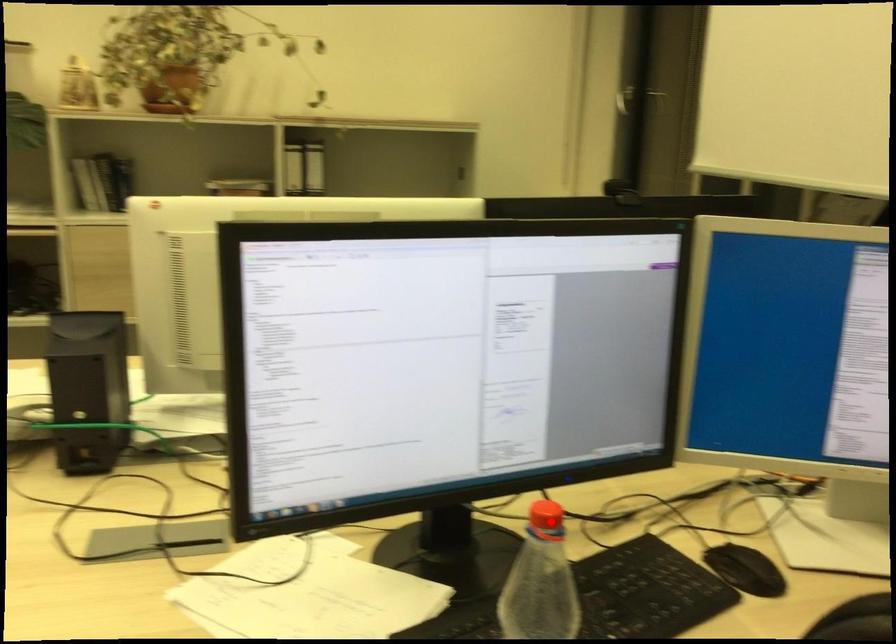
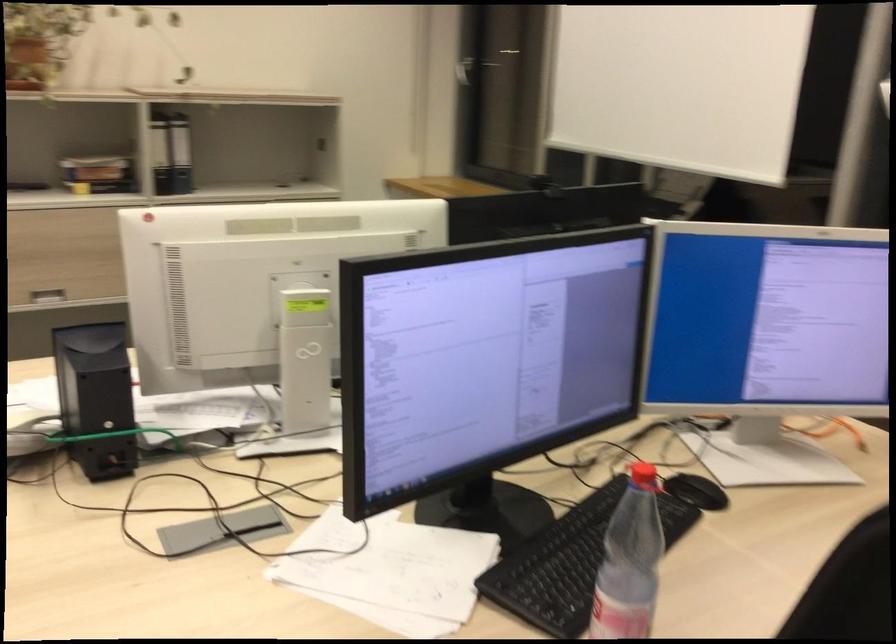
The point at the highlighted location is marked in the first image. Where is the corresponding point in the second image?

(642, 478)